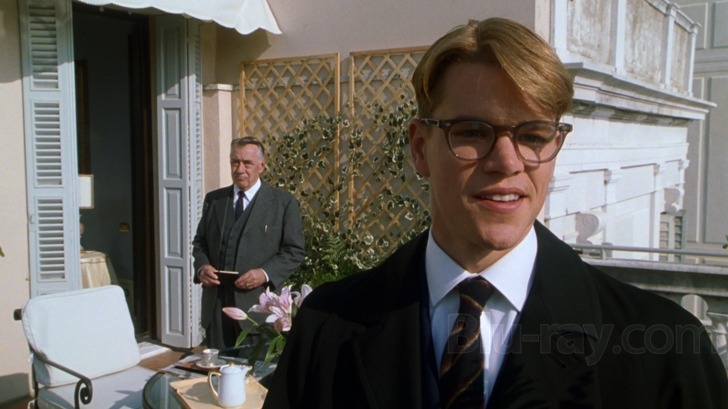
This screenshot has height=409, width=728. I want to click on chair, so click(91, 345).